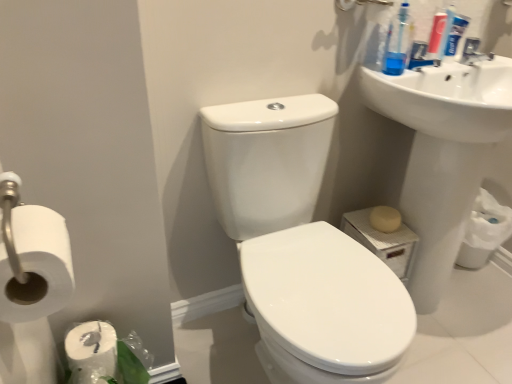
Question: Is white matte toilet paper at lower right, which is the second toilet paper from front to back, positioned before white glossy sink at upper right, which is the second sink from right to left?

Choices:
 (A) no
 (B) yes

Answer: (A)

Question: Could you tell me if white matte toilet paper at lower right, the 2th toilet paper viewed from the left, is facing white glossy sink at upper right, the first sink viewed from the left?

Choices:
 (A) yes
 (B) no

Answer: (B)

Question: Is white matte toilet paper at lower right, the 1th toilet paper viewed from the back, touching white glossy sink at upper right, which is the second sink from right to left?

Choices:
 (A) yes
 (B) no

Answer: (B)

Question: Can we say white matte toilet paper at lower right, acting as the 1th toilet paper starting from the right, lies outside white glossy sink at upper right, which is the second sink from right to left?

Choices:
 (A) yes
 (B) no

Answer: (A)

Question: Is white matte toilet paper at lower right, acting as the 1th toilet paper starting from the right, facing away from white glossy sink at upper right, the first sink viewed from the left?

Choices:
 (A) yes
 (B) no

Answer: (B)

Question: Is white glossy sink at upper right, the first sink viewed from the left, surrounded by white matte toilet paper at lower right, the 1th toilet paper viewed from the back?

Choices:
 (A) yes
 (B) no

Answer: (B)

Question: Does blue plastic toothbrush at upper right, which is counted as the 1th cleaning product, starting from the left, have a smaller size compared to white glossy sink at upper right, placed as the second sink when sorted from left to right?

Choices:
 (A) yes
 (B) no

Answer: (A)

Question: Could you tell me if blue plastic toothbrush at upper right, which is counted as the 1th cleaning product, starting from the left, is turned towards white glossy sink at upper right, which appears as the 1th sink when viewed from the right?

Choices:
 (A) no
 (B) yes

Answer: (A)

Question: From the image's perspective, does blue plastic toothbrush at upper right, which is counted as the 1th cleaning product, starting from the left, appear lower than white glossy sink at upper right, which appears as the 1th sink when viewed from the right?

Choices:
 (A) no
 (B) yes

Answer: (A)

Question: Can you confirm if blue plastic toothbrush at upper right, positioned as the second cleaning product in right-to-left order, is shorter than white glossy sink at upper right, which appears as the 1th sink when viewed from the right?

Choices:
 (A) no
 (B) yes

Answer: (B)

Question: Considering the relative positions of blue plastic toothbrush at upper right, positioned as the second cleaning product in right-to-left order, and white glossy sink at upper right, which appears as the 1th sink when viewed from the right, in the image provided, is blue plastic toothbrush at upper right, positioned as the second cleaning product in right-to-left order, to the right of white glossy sink at upper right, which appears as the 1th sink when viewed from the right, from the viewer's perspective?

Choices:
 (A) no
 (B) yes

Answer: (A)

Question: Is white glossy sink at upper right, placed as the second sink when sorted from left to right, located within blue plastic toothbrush at upper right, which is counted as the 1th cleaning product, starting from the left?

Choices:
 (A) no
 (B) yes

Answer: (A)

Question: Does white matte toilet paper at left, which is the 1th toilet paper in front-to-back order, have a larger size compared to beige matte soap at lower right?

Choices:
 (A) yes
 (B) no

Answer: (A)